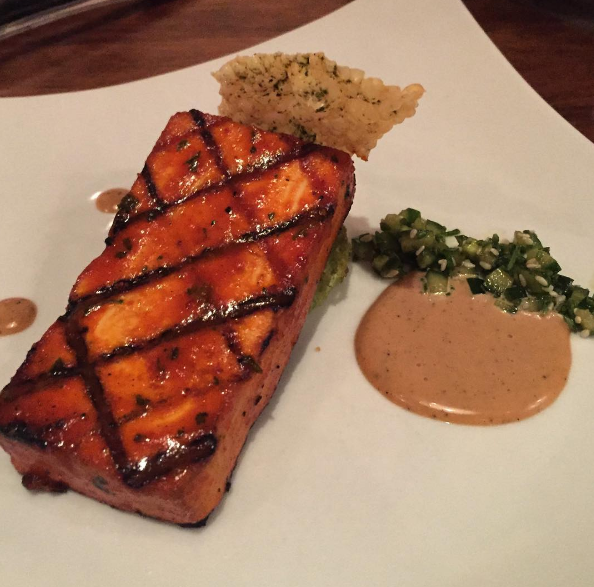
Locate an element on the screen. The image size is (594, 587). plate is located at coordinates tap(347, 465).